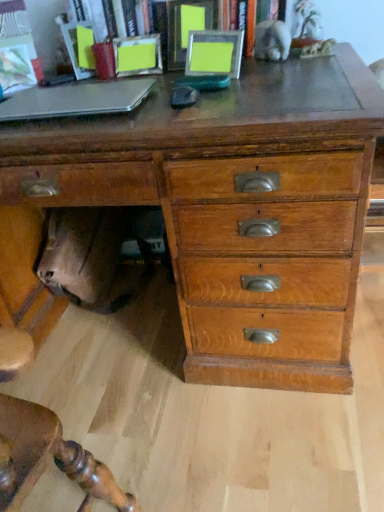
This screenshot has height=512, width=384. I want to click on free spot to the right of silver metallic laptop at left, so click(195, 101).